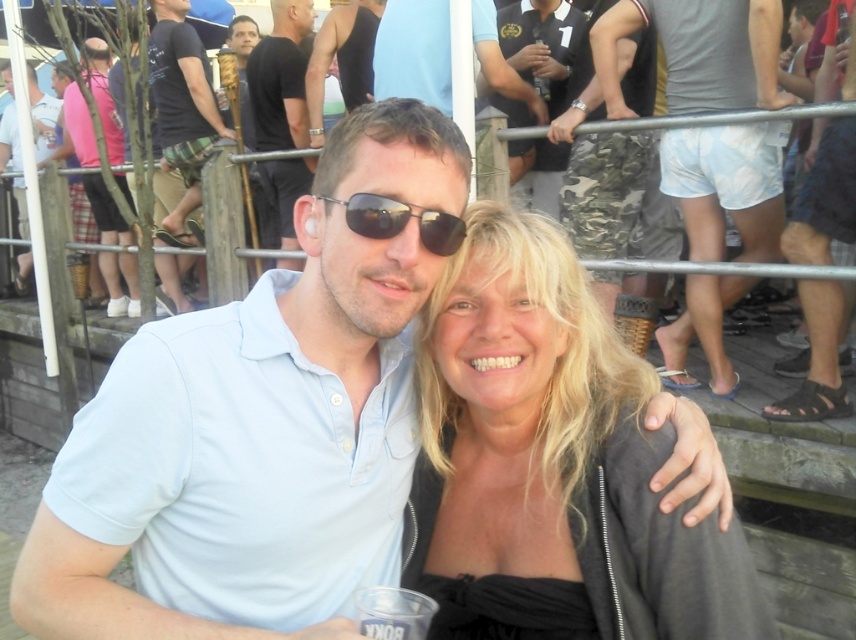
Between black matte shirt at center and matte black polo shirt at upper center, which one is positioned lower?

black matte shirt at center

Is black matte shirt at center above matte black polo shirt at upper center?

No.

Where is `black matte shirt at center`? black matte shirt at center is located at coordinates (280, 77).

How distant is black matte shirt at center from black matte tank top at upper center?

black matte shirt at center is 16.67 inches from black matte tank top at upper center.

Can you confirm if black matte shirt at center is positioned above black matte tank top at upper center?

No, black matte shirt at center is not above black matte tank top at upper center.

What do you see at coordinates (280, 77) in the screenshot? I see `black matte shirt at center` at bounding box center [280, 77].

Image resolution: width=856 pixels, height=640 pixels. Identify the location of black matte shirt at center. (280, 77).

Is point (502, 29) farther from viewer compared to point (296, 241)?

Yes, it is behind point (296, 241).

The height and width of the screenshot is (640, 856). In order to click on camouflage shorts at center in this screenshot , I will do `click(539, 44)`.

The height and width of the screenshot is (640, 856). Find the location of `camouflage shorts at center`. camouflage shorts at center is located at coordinates (539, 44).

At what (x,y) coordinates should I click in order to perform the action: click on camouflage shorts at center. Please return your answer as a coordinate pair (x, y). Looking at the image, I should click on (539, 44).